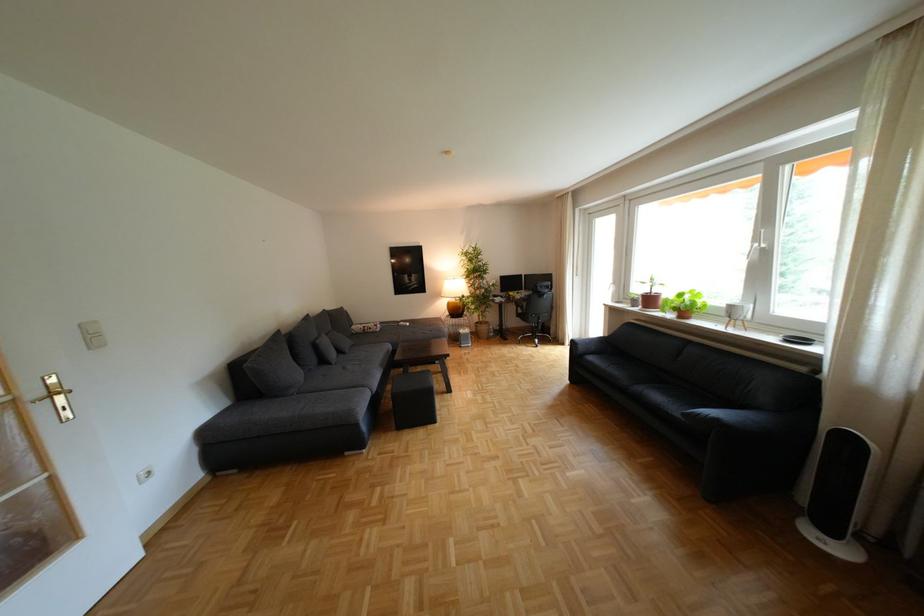
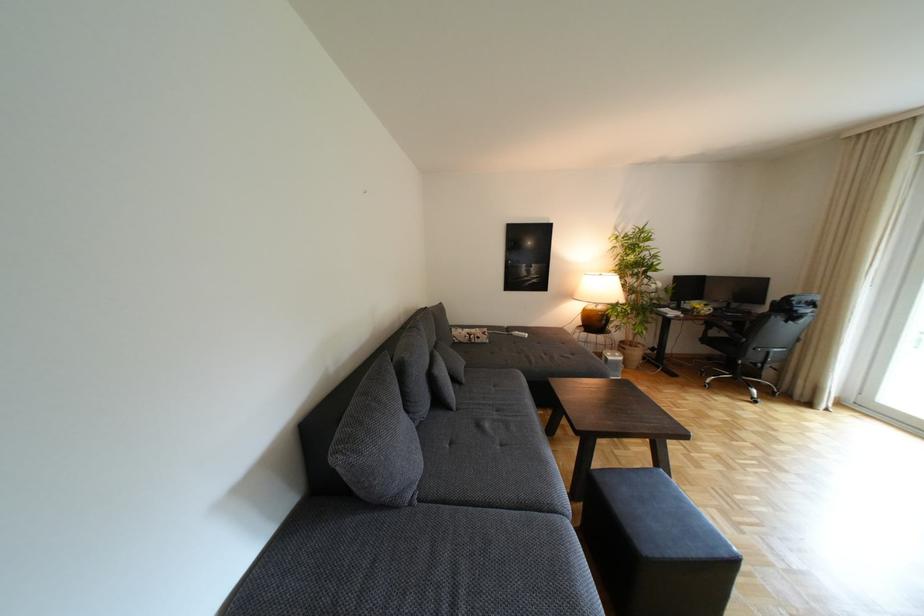
Where in the second image is the point corresponding to (353,352) from the first image?

(468, 379)